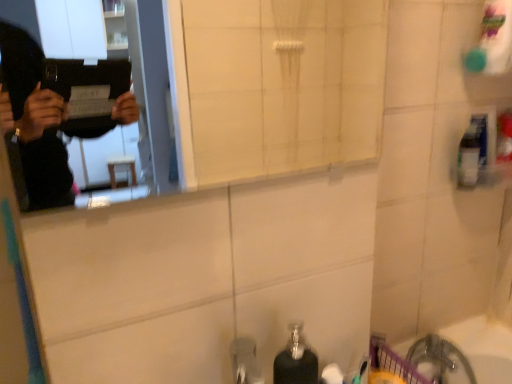
Question: Does white glossy mirror at upper center come in front of clear plastic bottle at upper right?

Choices:
 (A) no
 (B) yes

Answer: (B)

Question: Is white glossy mirror at upper center facing away from clear plastic bottle at upper right?

Choices:
 (A) no
 (B) yes

Answer: (A)

Question: From a real-world perspective, is white glossy mirror at upper center physically below clear plastic bottle at upper right?

Choices:
 (A) yes
 (B) no

Answer: (B)

Question: Is white glossy mirror at upper center bigger than clear plastic bottle at upper right?

Choices:
 (A) no
 (B) yes

Answer: (B)

Question: Can you confirm if white glossy mirror at upper center is taller than clear plastic bottle at upper right?

Choices:
 (A) no
 (B) yes

Answer: (B)

Question: In terms of size, does clear plastic bottle at upper right appear bigger or smaller than black matte soap dispenser at lower center?

Choices:
 (A) small
 (B) big

Answer: (A)

Question: Is clear plastic bottle at upper right wider or thinner than black matte soap dispenser at lower center?

Choices:
 (A) thin
 (B) wide

Answer: (B)

Question: Considering the relative positions of clear plastic bottle at upper right and black matte soap dispenser at lower center in the image provided, is clear plastic bottle at upper right to the left or to the right of black matte soap dispenser at lower center?

Choices:
 (A) right
 (B) left

Answer: (A)

Question: Considering the positions of point (468, 152) and point (300, 374), is point (468, 152) closer or farther from the camera than point (300, 374)?

Choices:
 (A) closer
 (B) farther

Answer: (B)

Question: In the image, is white plastic bath at lower right on the left side or the right side of clear plastic bottle at upper right?

Choices:
 (A) left
 (B) right

Answer: (A)

Question: Considering the positions of white plastic bath at lower right and clear plastic bottle at upper right in the image, is white plastic bath at lower right bigger or smaller than clear plastic bottle at upper right?

Choices:
 (A) small
 (B) big

Answer: (B)

Question: Is white plastic bath at lower right wider or thinner than clear plastic bottle at upper right?

Choices:
 (A) wide
 (B) thin

Answer: (A)

Question: Considering the positions of point (490, 332) and point (474, 117), is point (490, 332) closer or farther from the camera than point (474, 117)?

Choices:
 (A) farther
 (B) closer

Answer: (A)

Question: Is black matte soap dispenser at lower center taller or shorter than clear plastic bottle at upper right?

Choices:
 (A) tall
 (B) short

Answer: (A)

Question: From the image's perspective, is black matte soap dispenser at lower center positioned above or below clear plastic bottle at upper right?

Choices:
 (A) below
 (B) above

Answer: (A)